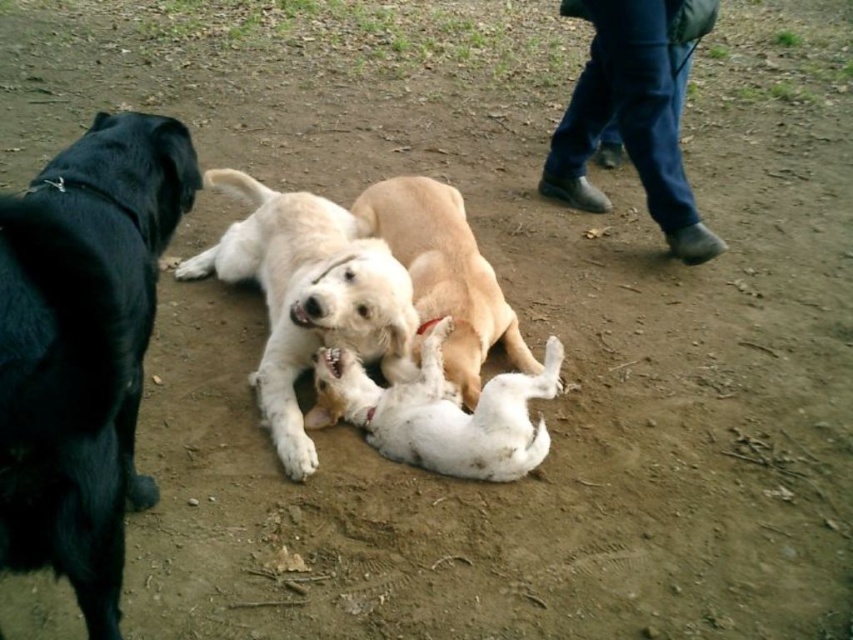
Question: Does white fur dog at center have a greater width compared to white soft fur dog at center?

Choices:
 (A) no
 (B) yes

Answer: (B)

Question: Which point is farther to the camera?

Choices:
 (A) white fur dog at center
 (B) shiny black dog at left
 (C) white soft fur dog at center
 (D) light brown fur at center

Answer: (D)

Question: Which object is the farthest from the light brown fur at center?

Choices:
 (A) white soft fur dog at center
 (B) shiny black dog at left
 (C) white fur dog at center

Answer: (B)

Question: Can you confirm if shiny black dog at left is positioned above white soft fur dog at center?

Choices:
 (A) yes
 (B) no

Answer: (A)

Question: Is shiny black dog at left to the right of light brown fur at center from the viewer's perspective?

Choices:
 (A) no
 (B) yes

Answer: (A)

Question: Considering the real-world distances, which object is farthest from the white soft fur dog at center?

Choices:
 (A) light brown fur at center
 (B) white fur dog at center

Answer: (B)